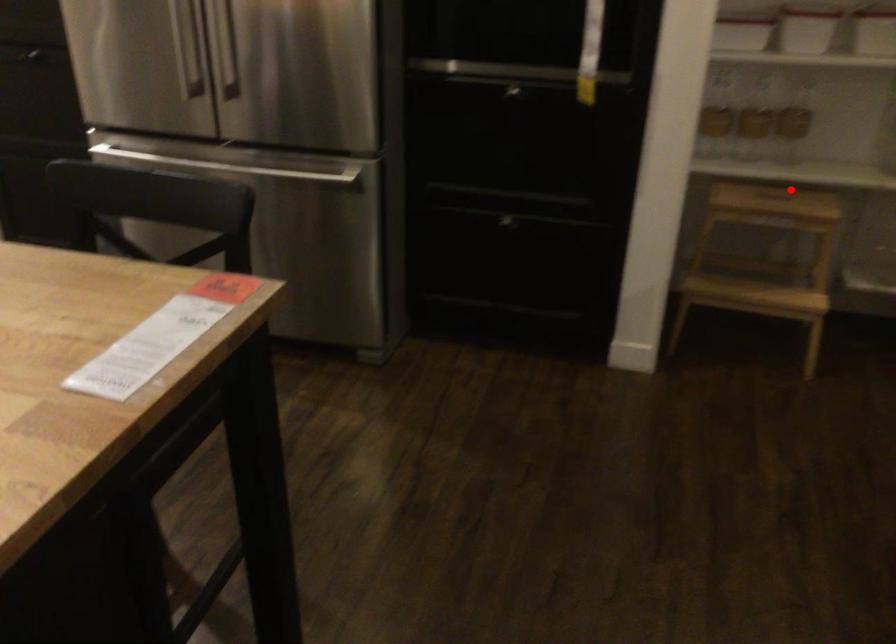
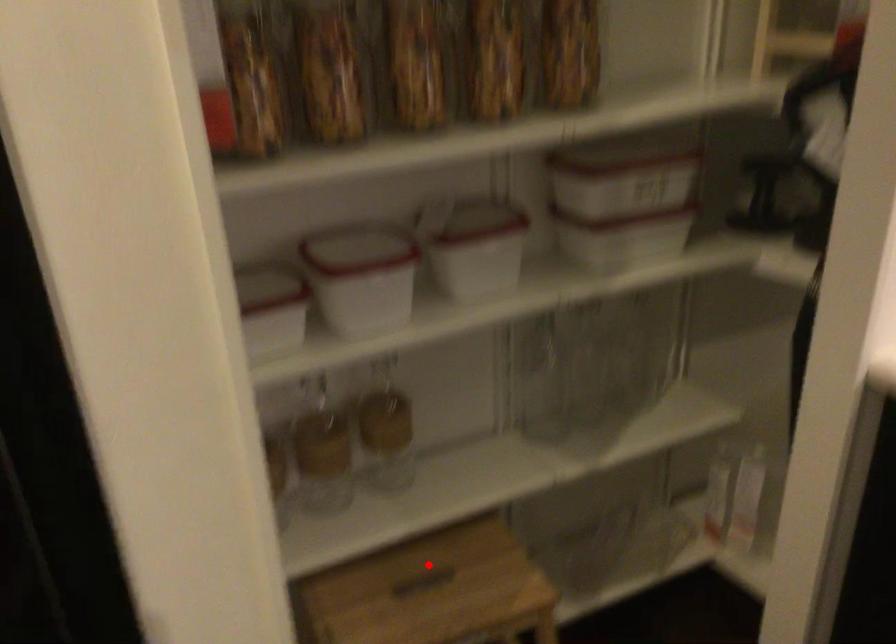
I am providing you with two images of the same scene from different viewpoints. A red point is marked on the first image and another point is marked on the second image. Does the point marked in image1 correspond to the same location as the one in image2?

Yes